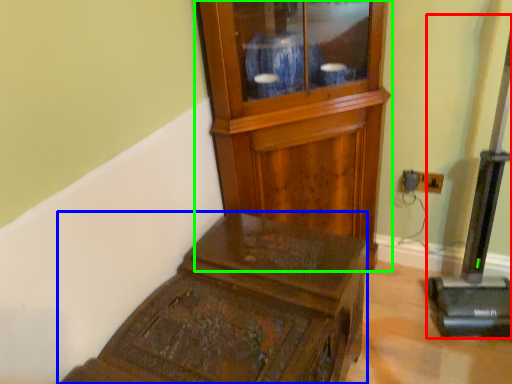
Question: Considering the real-world distances, which object is farthest from equipment (highlighted by a red box)? furniture (highlighted by a blue box) or side cabinet (highlighted by a green box)?

Choices:
 (A) furniture
 (B) side cabinet

Answer: (A)